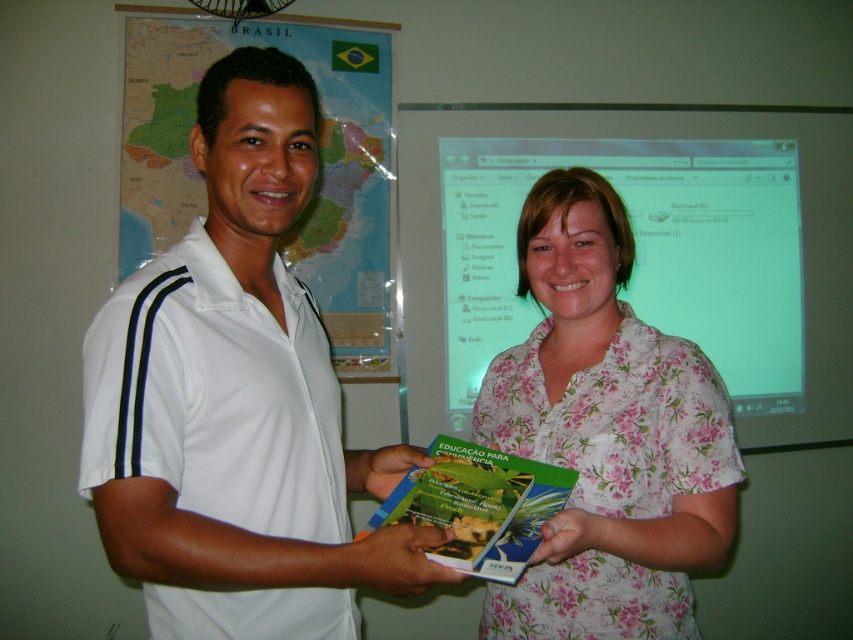
You are a photographer standing 1 meter away from the two people in the image. You want to take a photo that includes both the white smooth shirt at center and the floral fabric shirt at center without any part of them being cut off. What is the minimum width of the camera lens you need to capture both shirts in the frame?

The distance between the white smooth shirt at center and the floral fabric shirt at center is 32.36 centimeters. Since you are standing 1 meter away, the minimum lens width required would need to cover at least 32.36 cm to include both shirts fully in the frame.

You are a delivery robot with a height of 1.2 meters. You need to place a package on a table located at point (212, 284). The table is 70 centimeters tall. Can you reach the table to place the package?

The distance of point (212, 284) from camera is 98.05 centimeters. Since the robot is 1.2 meters tall and the table is 70 centimeters tall, the robot can easily reach the table to place the package as it is taller than the table.